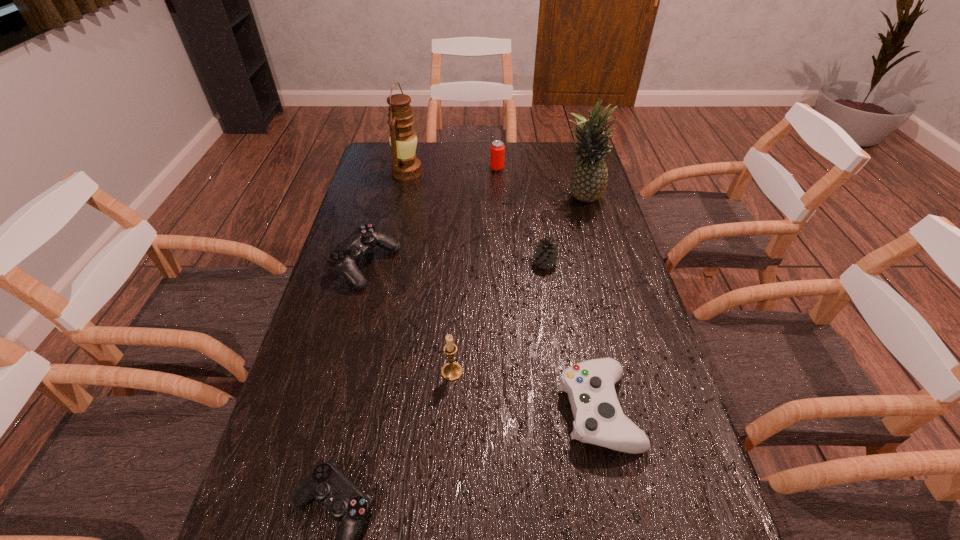
The image size is (960, 540). What are the coordinates of `oil lamp` in the screenshot? It's located at (405, 166).

The height and width of the screenshot is (540, 960). I want to click on the third farthest object, so click(589, 178).

Locate an element on the screen. Image resolution: width=960 pixels, height=540 pixels. pineapple is located at coordinates (589, 178).

You are a GUI agent. You are given a task and a screenshot of the screen. Output one action in this format:
    pyautogui.click(x=<x>, y=<y>)
    Task: Click on the sixth shortest object
    This screenshot has height=540, width=960.
    Given the screenshot: What is the action you would take?
    pyautogui.click(x=451, y=371)

Find the location of a particular element. The image size is (960, 540). candle holder is located at coordinates (451, 371).

At what (x,y) coordinates should I click in order to perform the action: click on red beer can. Please return your answer as a coordinate pair (x, y). Looking at the image, I should click on (497, 148).

At what (x,y) coordinates should I click in order to perform the action: click on beer can. Please return your answer as a coordinate pair (x, y). This screenshot has width=960, height=540. Looking at the image, I should click on (497, 148).

This screenshot has width=960, height=540. Identify the location of brown pinecone. (546, 253).

Where is `the bigger black control`? This screenshot has width=960, height=540. the bigger black control is located at coordinates (343, 258).

Image resolution: width=960 pixels, height=540 pixels. I want to click on the farthest control, so click(x=343, y=258).